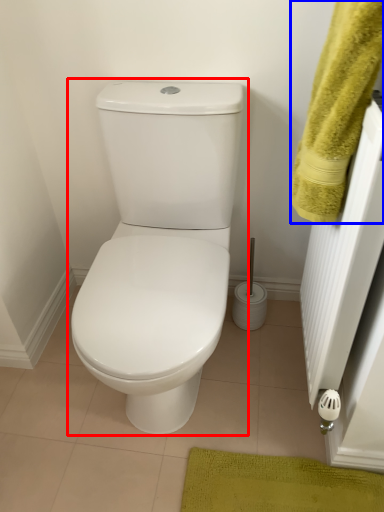
Question: Which of the following is the closest to the observer, toilet (highlighted by a red box) or bath towel (highlighted by a blue box)?

Choices:
 (A) toilet
 (B) bath towel

Answer: (B)